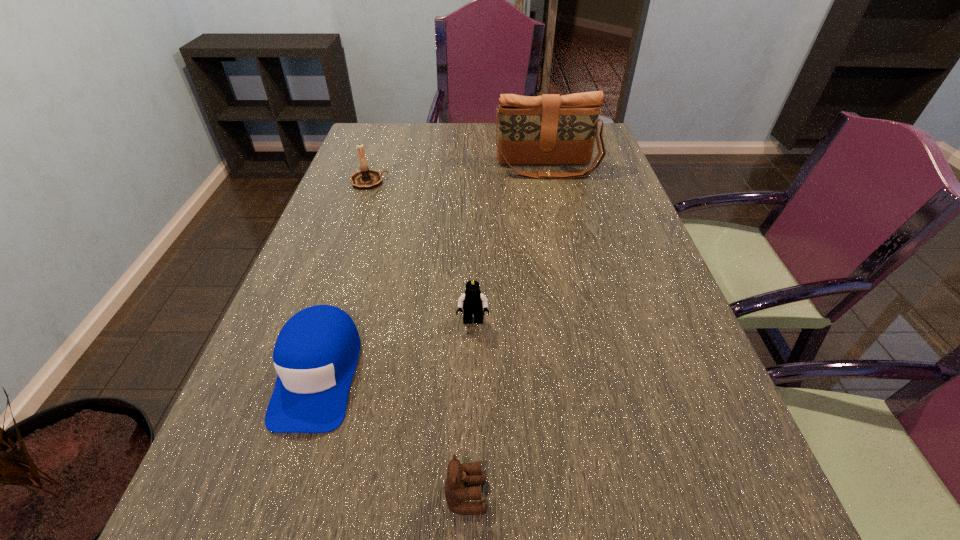
Locate an element on the screen. The height and width of the screenshot is (540, 960). free location located 0.110m on the face of the teddy bear is located at coordinates (557, 496).

The image size is (960, 540). I want to click on candle holder that is at the left edge, so click(x=366, y=178).

Where is `baseball cap located at the left edge`? Image resolution: width=960 pixels, height=540 pixels. baseball cap located at the left edge is located at coordinates (315, 355).

This screenshot has height=540, width=960. I want to click on object positioned at the right edge, so click(x=550, y=129).

The height and width of the screenshot is (540, 960). In the image, there is a desktop. In order to click on free space at the far edge in this screenshot , I will do `click(488, 133)`.

This screenshot has width=960, height=540. I want to click on free space at the left edge, so click(324, 211).

Find the location of a particular element. This screenshot has height=540, width=960. free space at the right edge is located at coordinates (591, 235).

Find the location of a particular element. The image size is (960, 540). empty space between the nearest object and the Lego is located at coordinates (469, 409).

The width and height of the screenshot is (960, 540). Find the location of `vacant space that's between the candle holder and the nearest object`. vacant space that's between the candle holder and the nearest object is located at coordinates (418, 338).

What are the coordinates of `vacant area that lies between the nearest object and the Lego` in the screenshot? It's located at (469, 409).